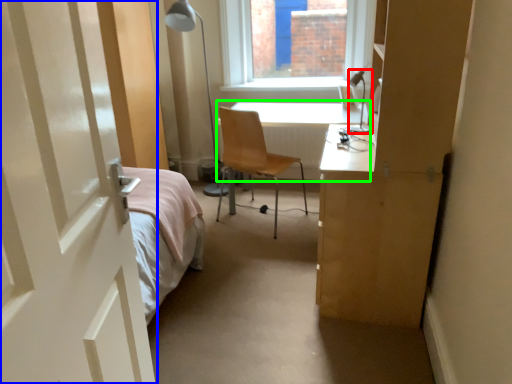
Question: Estimate the real-world distances between objects in this image. Which object is farther from table lamp (highlighted by a red box), door (highlighted by a blue box) or table (highlighted by a green box)?

Choices:
 (A) door
 (B) table

Answer: (A)